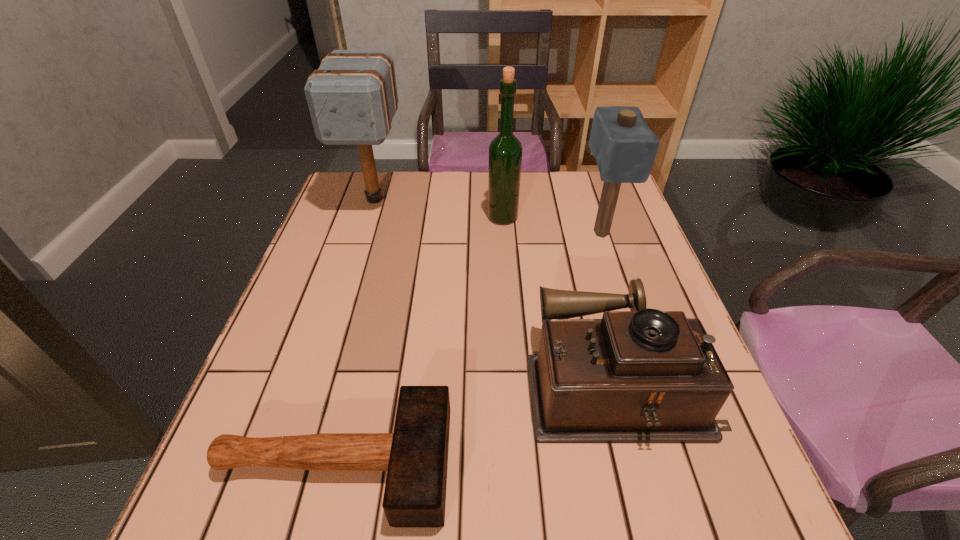
Find the location of a particular element. The width and height of the screenshot is (960, 540). liquor is located at coordinates (505, 151).

In order to click on the second tallest mallet in this screenshot , I will do `click(624, 147)`.

At what (x,y) coordinates should I click in order to perform the action: click on the third shortest object. Please return your answer as a coordinate pair (x, y). Image resolution: width=960 pixels, height=540 pixels. Looking at the image, I should click on (624, 147).

Locate an element on the screen. Image resolution: width=960 pixels, height=540 pixels. phonograph_record is located at coordinates (641, 376).

The width and height of the screenshot is (960, 540). I want to click on the nearest mallet, so click(415, 456).

At what (x,y) coordinates should I click in order to perform the action: click on the shortest mallet. Please return your answer as a coordinate pair (x, y). This screenshot has height=540, width=960. Looking at the image, I should click on (415, 456).

Locate an element on the screen. vacant region located 0.060m on the back of the liquor is located at coordinates (x=501, y=198).

Locate an element on the screen. Image resolution: width=960 pixels, height=540 pixels. vacant space located 0.100m on the left of the third tallest object is located at coordinates (544, 233).

Where is `blank space located 0.100m on the horn of the phonograph_record`? The width and height of the screenshot is (960, 540). blank space located 0.100m on the horn of the phonograph_record is located at coordinates (478, 381).

Find the location of a particular element. Image resolution: width=960 pixels, height=540 pixels. vacant region located on the horn of the phonograph_record is located at coordinates (386, 381).